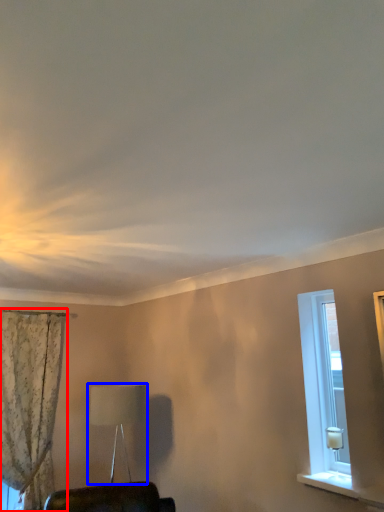
Question: Which of the following is the farthest to the observer, curtain (highlighted by a red box) or table lamp (highlighted by a blue box)?

Choices:
 (A) curtain
 (B) table lamp

Answer: (A)